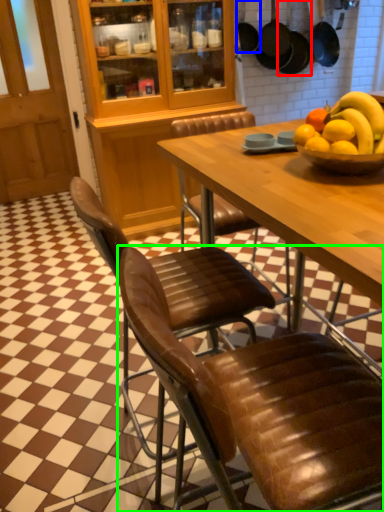
Question: Which object is positioned farthest from frying pan (highlighted by a red box)? Select from frying pan (highlighted by a blue box) and chair (highlighted by a green box).

Choices:
 (A) frying pan
 (B) chair

Answer: (B)